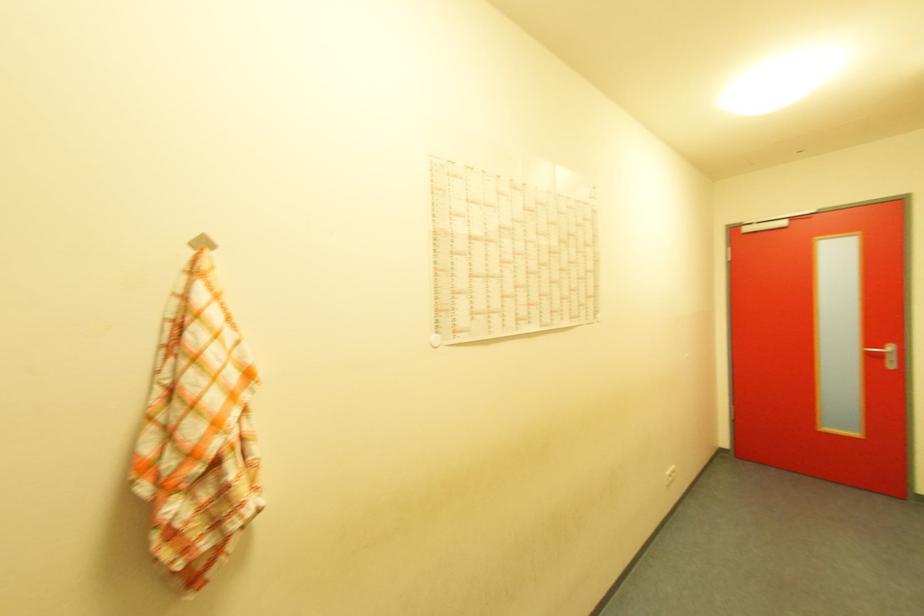
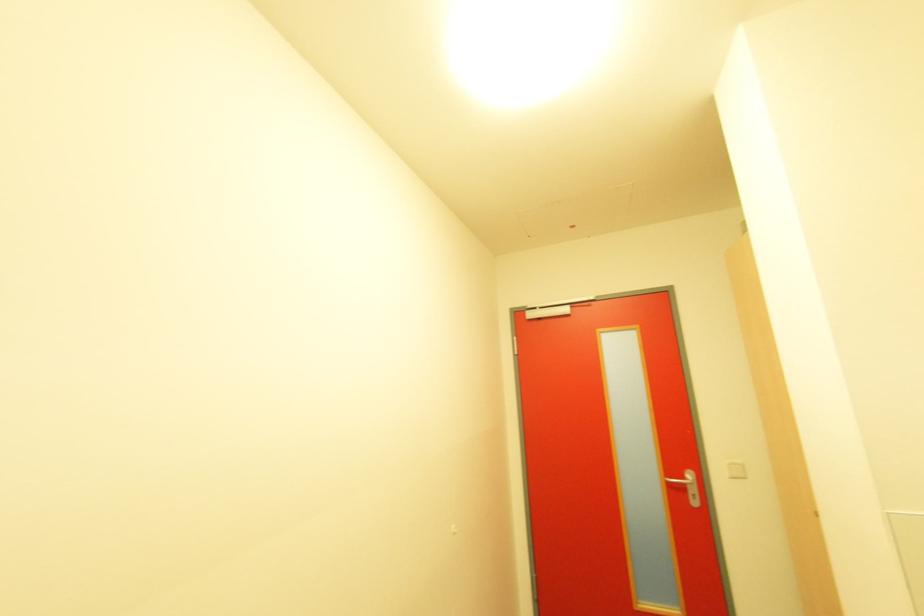
Find the pixel in the second image that matches pixel 894 350 in the first image.

(694, 477)